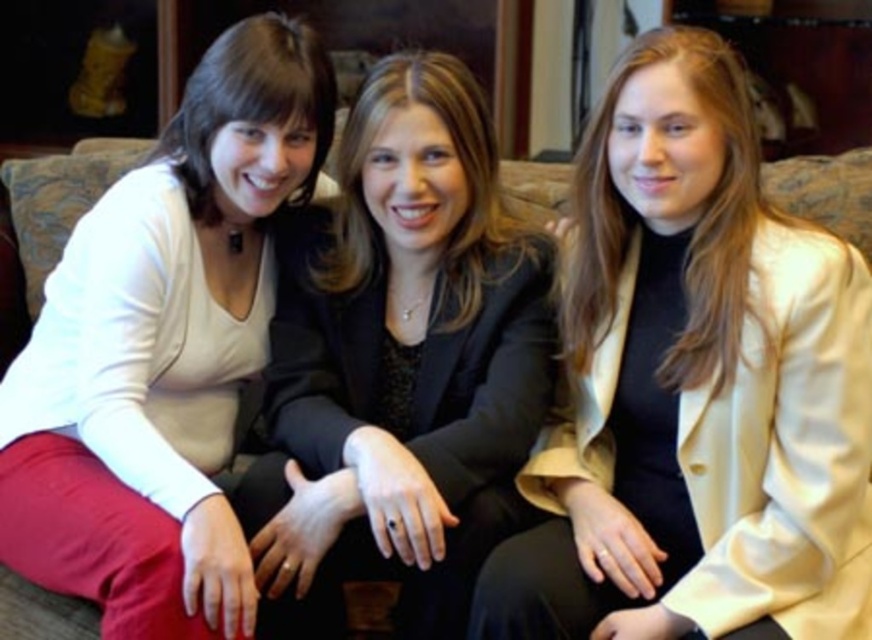
Which of these two, satin beige blazer at center or black satin blazer at center, stands shorter?

With less height is satin beige blazer at center.

Can you confirm if satin beige blazer at center is smaller than black satin blazer at center?

Incorrect, satin beige blazer at center is not smaller in size than black satin blazer at center.

Which is in front, point (637, 160) or point (436, 196)?

Point (637, 160) is more forward.

Identify the location of satin beige blazer at center. This screenshot has width=872, height=640. (693, 387).

Can you confirm if satin beige blazer at center is positioned to the right of matte white blouse at left?

Yes, satin beige blazer at center is to the right of matte white blouse at left.

Who is more distant from viewer, [753,296] or [262,97]?

The point [262,97] is behind.

This screenshot has height=640, width=872. Find the location of `satin beige blazer at center`. satin beige blazer at center is located at coordinates (693, 387).

Who is higher up, matte white blouse at left or black satin blazer at center?

Positioned higher is matte white blouse at left.

Identify the location of matte white blouse at left. (162, 349).